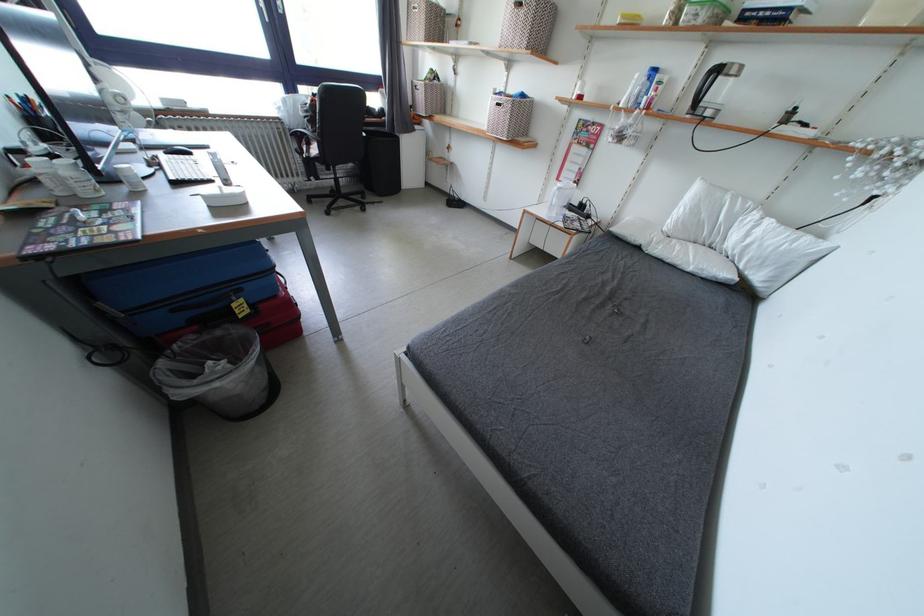
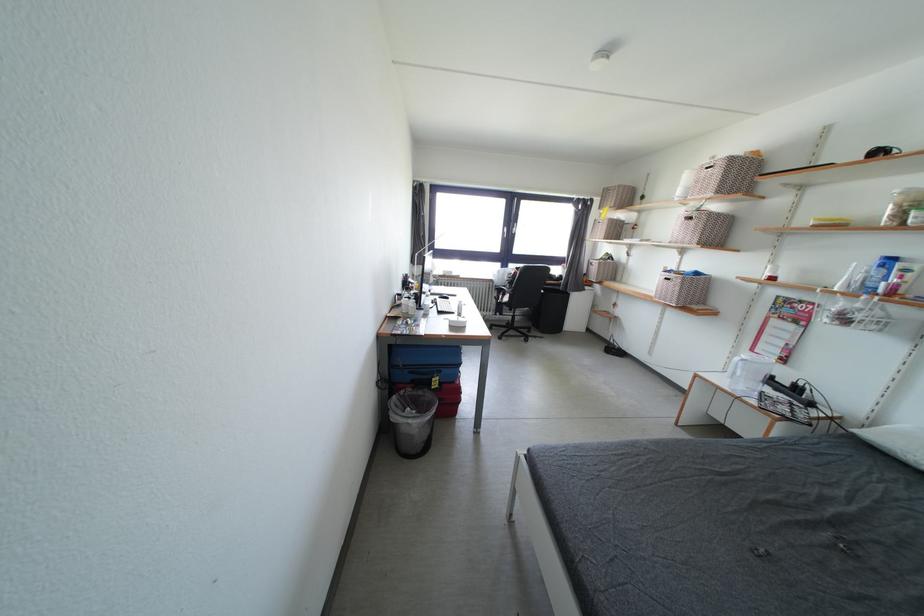
Find the pixel in the second image that matches point (584, 97) in the first image.

(773, 278)